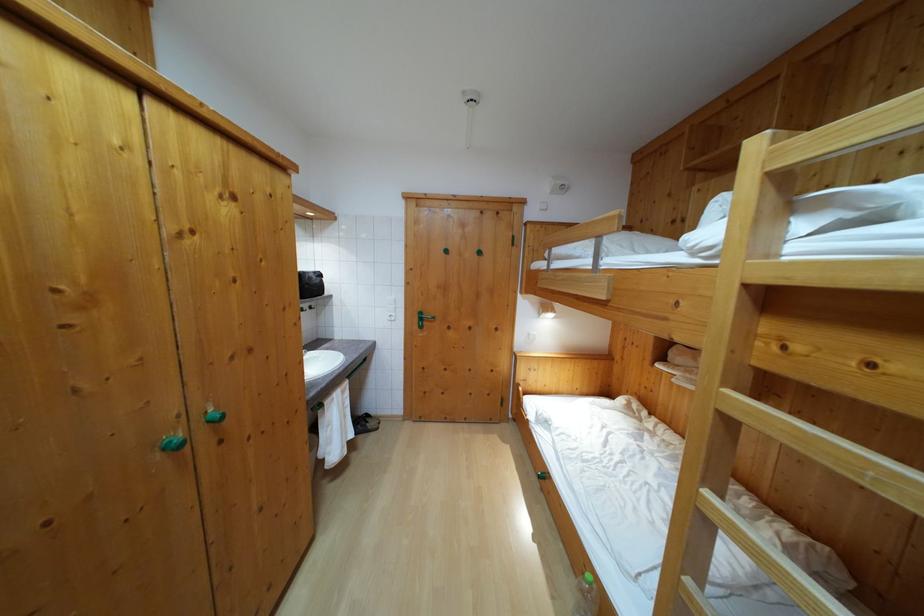
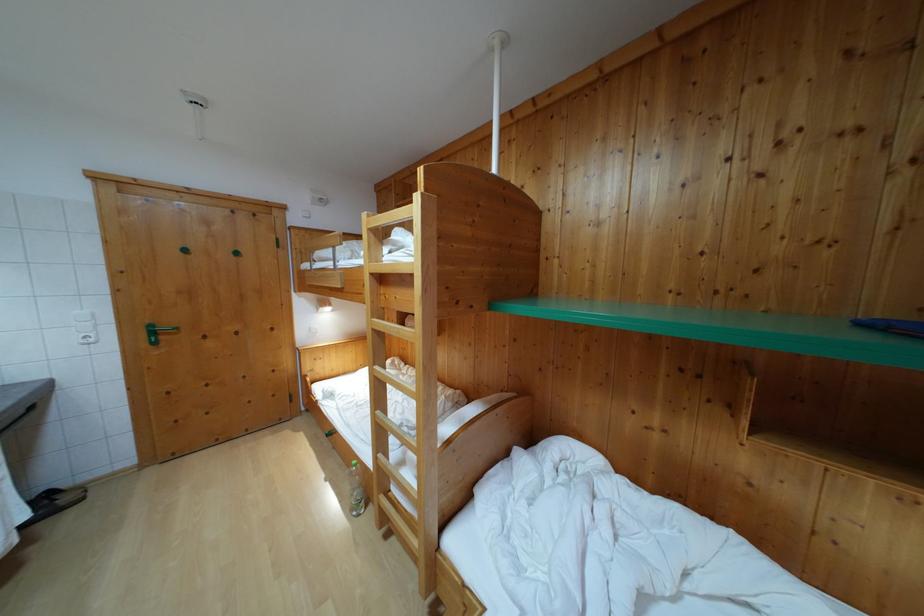
The point at (x=779, y=146) is marked in the first image. Where is the corresponding point in the second image?

(371, 223)